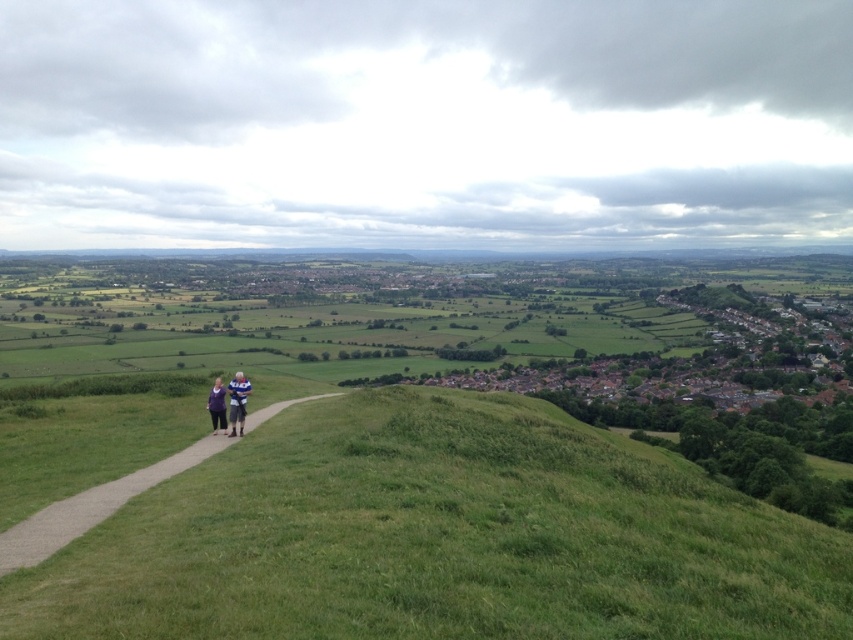
Does green grassy hillside at center have a greater width compared to blue fabric shirt at center?

Correct, the width of green grassy hillside at center exceeds that of blue fabric shirt at center.

Who is more forward, [125,620] or [235,433]?

Point [125,620]

At what (x,y) coordinates should I click in order to perform the action: click on green grassy hillside at center. Please return your answer as a coordinate pair (x, y). Image resolution: width=853 pixels, height=640 pixels. Looking at the image, I should click on (439, 538).

Who is positioned more to the right, blue fabric shirt at center or purple fabric at center?

blue fabric shirt at center

Who is taller, blue fabric shirt at center or purple fabric at center?

With more height is blue fabric shirt at center.

At what (x,y) coordinates should I click in order to perform the action: click on blue fabric shirt at center. Please return your answer as a coordinate pair (x, y). The image size is (853, 640). Looking at the image, I should click on (236, 401).

Where is `blue fabric shirt at center`? blue fabric shirt at center is located at coordinates (236, 401).

Can you confirm if gravel path at center is wider than blue fabric shirt at center?

Yes, gravel path at center is wider than blue fabric shirt at center.

Between point (51, 534) and point (235, 381), which one is positioned behind?

The point (235, 381) is behind.

Between point (206, 445) and point (229, 388), which one is positioned behind?

Positioned behind is point (229, 388).

Identify the location of gravel path at center. (91, 508).